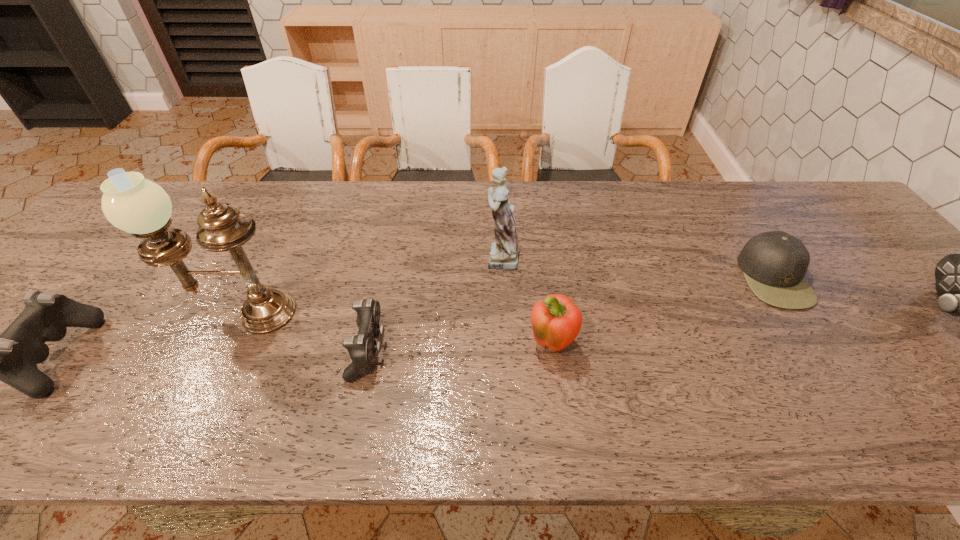
You are a GUI agent. You are given a task and a screenshot of the screen. Output one action in this format:
    pyautogui.click(x=<x>, y=<y>)
    Task: Click on the vacant space located on the surface of the second control from left to right with buttons
    This screenshot has width=960, height=540.
    Given the screenshot: What is the action you would take?
    pyautogui.click(x=557, y=350)

This screenshot has width=960, height=540. Find the location of `vacant space situated 0.190m on the front-facing side of the sixth shortest object`. vacant space situated 0.190m on the front-facing side of the sixth shortest object is located at coordinates (407, 257).

Locate an element on the screen. vacant space located 0.080m on the front-facing side of the sixth shortest object is located at coordinates (448, 257).

Locate an element on the screen. The height and width of the screenshot is (540, 960). free region located 0.150m on the front-facing side of the sixth shortest object is located at coordinates (422, 257).

This screenshot has width=960, height=540. I want to click on vacant region located 0.160m on the brim of the cap, so point(681,278).

This screenshot has height=540, width=960. I want to click on free location located on the brim of the cap, so click(697, 278).

What are the coordinates of `vacant space situated 0.150m on the brim of the cap` in the screenshot? It's located at (684, 278).

Identify the location of vacant space situated 0.380m on the left of the oil lamp. The image size is (960, 540). (28, 313).

This screenshot has width=960, height=540. I want to click on vacant position located on the right of the pepper, so click(600, 346).

The image size is (960, 540). I want to click on pepper that is at the near edge, so click(556, 321).